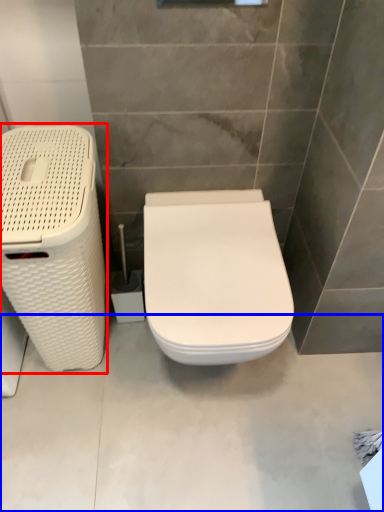
Question: Which of the following is the farthest to the observer, laundry basket (highlighted by a red box) or concrete (highlighted by a blue box)?

Choices:
 (A) laundry basket
 (B) concrete

Answer: (B)